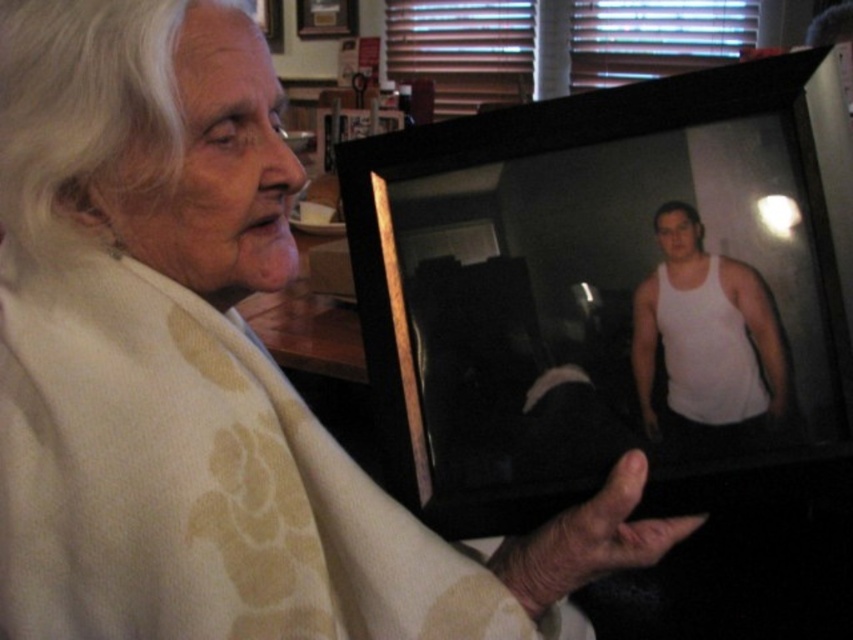
Question: Which point is farther from the camera taking this photo?

Choices:
 (A) (659, 280)
 (B) (498, 492)

Answer: (B)

Question: Is black plastic picture frame at center above white matte tank top at center?

Choices:
 (A) no
 (B) yes

Answer: (B)

Question: Does black plastic picture frame at center have a larger size compared to white matte tank top at center?

Choices:
 (A) yes
 (B) no

Answer: (A)

Question: Does black plastic picture frame at center lie behind white matte tank top at center?

Choices:
 (A) no
 (B) yes

Answer: (A)